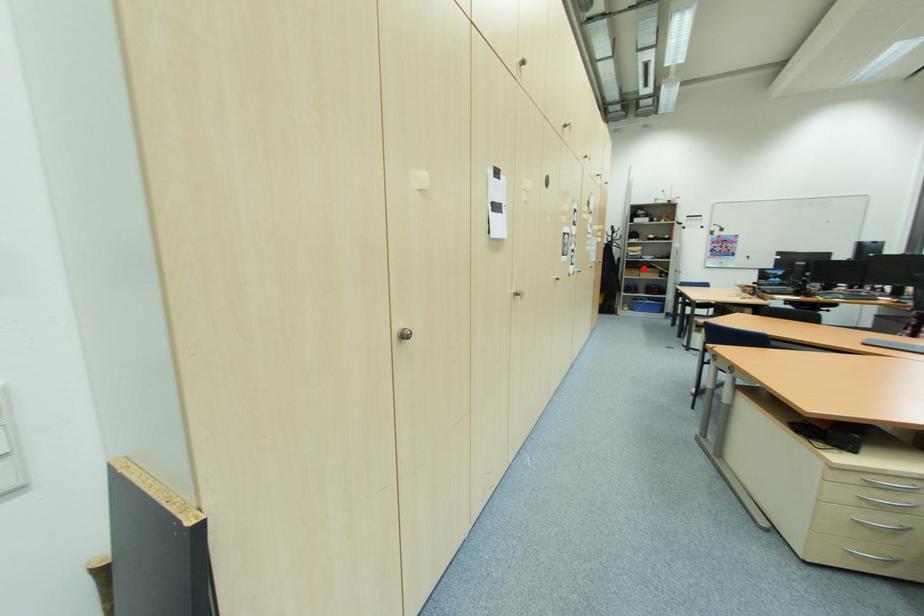
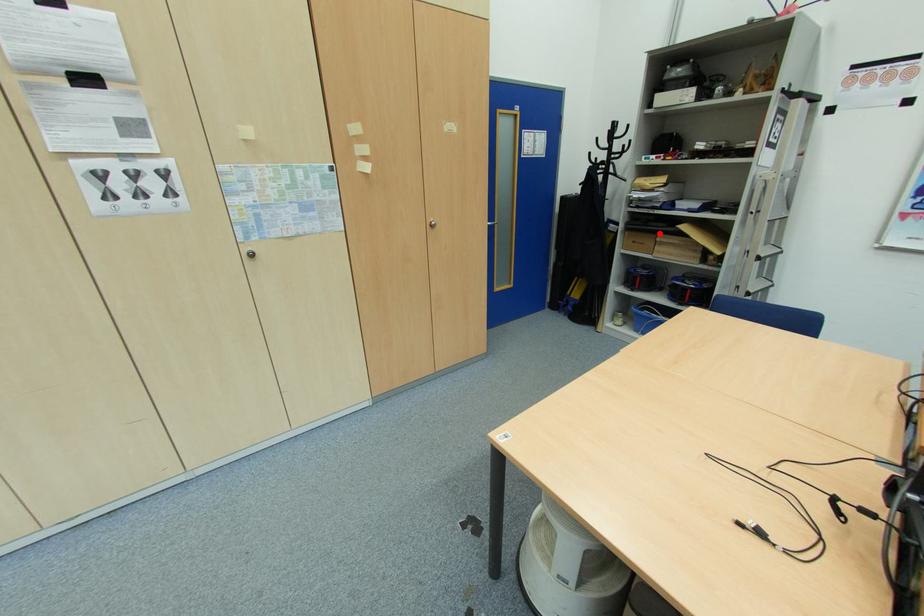
I am providing you with two images of the same scene from different viewpoints. A red point is marked on the first image and another point is marked on the second image. Is the marked point in image1 the same physical position as the marked point in image2?

Yes